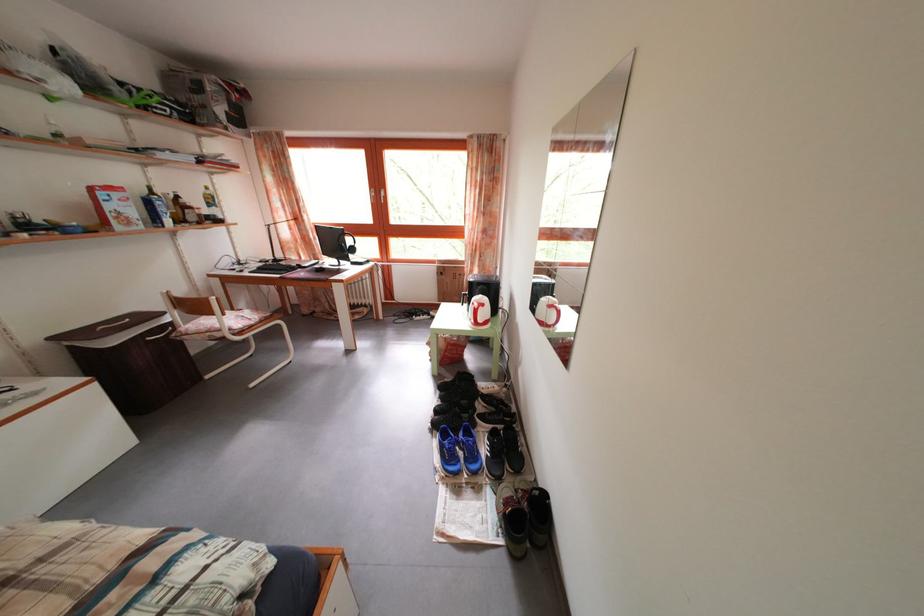
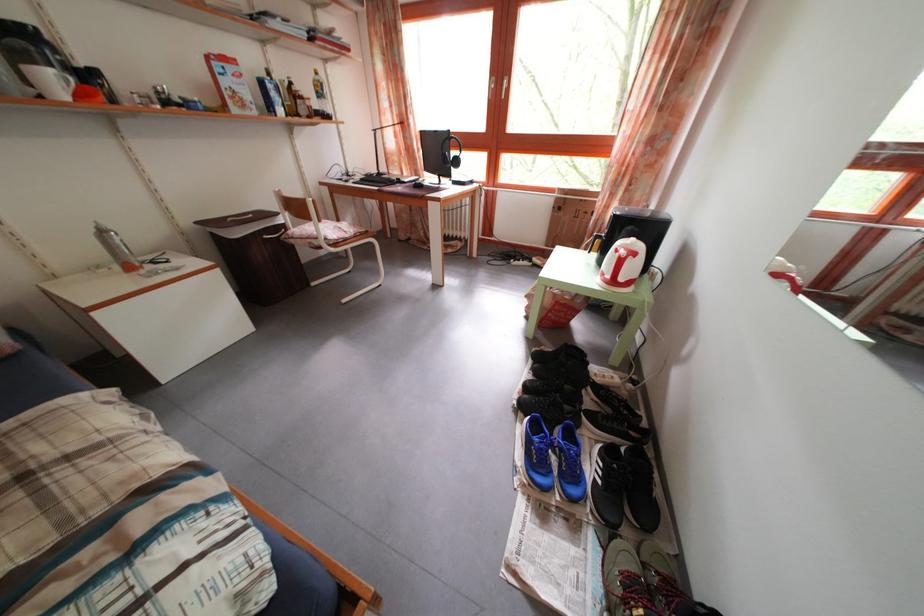
Where in the second image is the point corresponding to (x=310, y=265) from the first image?

(412, 182)